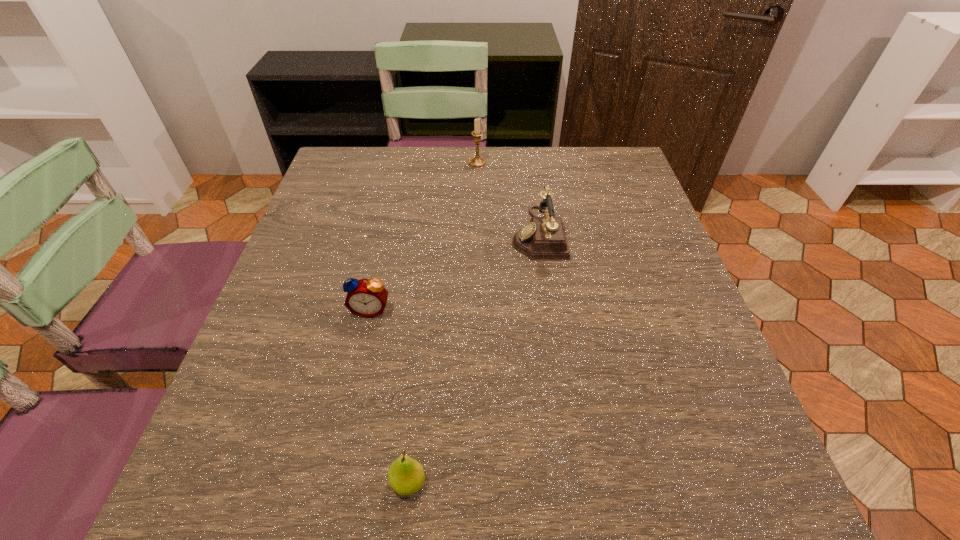
In the image, there is a desktop. Identify the location of vacant space at the far right corner. (592, 153).

Identify the location of free area in between the pear and the alarm clock. (390, 396).

I want to click on empty location between the rightmost object and the third object from left to right, so click(x=508, y=198).

Find the location of `vacant point located between the second farthest object and the third object from left to right`. vacant point located between the second farthest object and the third object from left to right is located at coordinates (508, 198).

Find the location of a particular element. Image resolution: width=960 pixels, height=540 pixels. vacant point located between the candle holder and the pear is located at coordinates (444, 322).

Identify the location of free space between the nearest object and the telephone. The image size is (960, 540). pos(473,358).

At what (x,y) coordinates should I click in order to perform the action: click on free space between the rightmost object and the leftmost object. Please return your answer as a coordinate pair (x, y). Looking at the image, I should click on (454, 271).

Locate an element on the screen. The height and width of the screenshot is (540, 960). free point between the second object from left to right and the leftmost object is located at coordinates (390, 396).

Find the location of `vacant space that is in between the second object from left to right and the second object from right to left`. vacant space that is in between the second object from left to right and the second object from right to left is located at coordinates (444, 322).

The height and width of the screenshot is (540, 960). What are the coordinates of `vacant area that lies between the tallest object and the pear` in the screenshot? It's located at (444, 322).